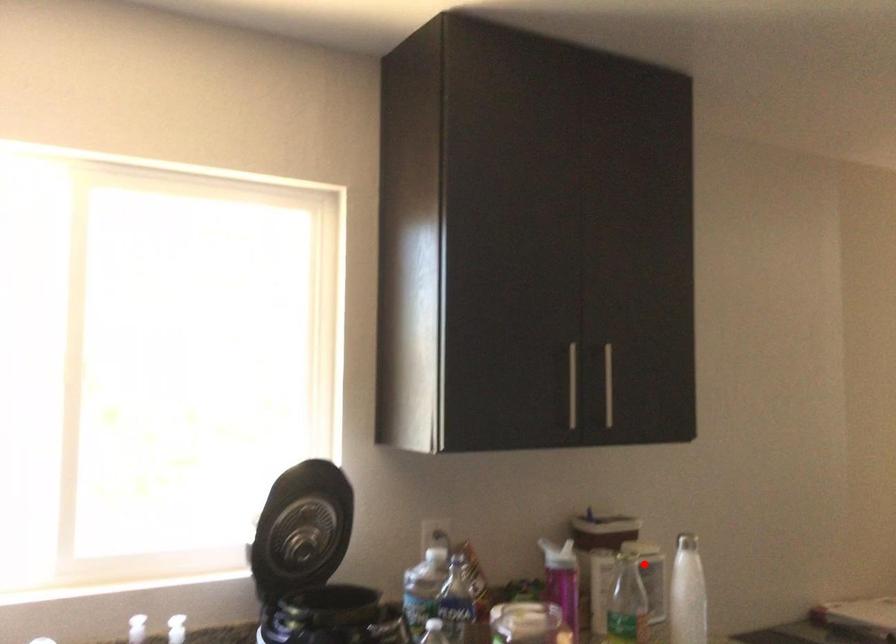
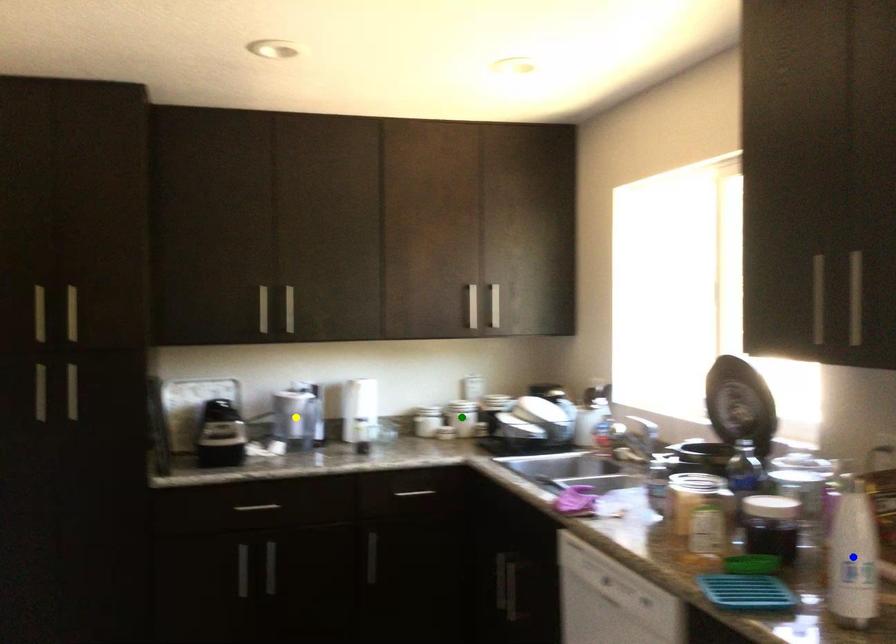
Question: I am providing you with two images of the same scene from different viewpoints. A red point is marked on the first image. You are given multiple points on the second image. In image 2, which mark is for the same physical point as the one in image 1?

Choices:
 (A) blue point
 (B) green point
 (C) yellow point

Answer: (A)